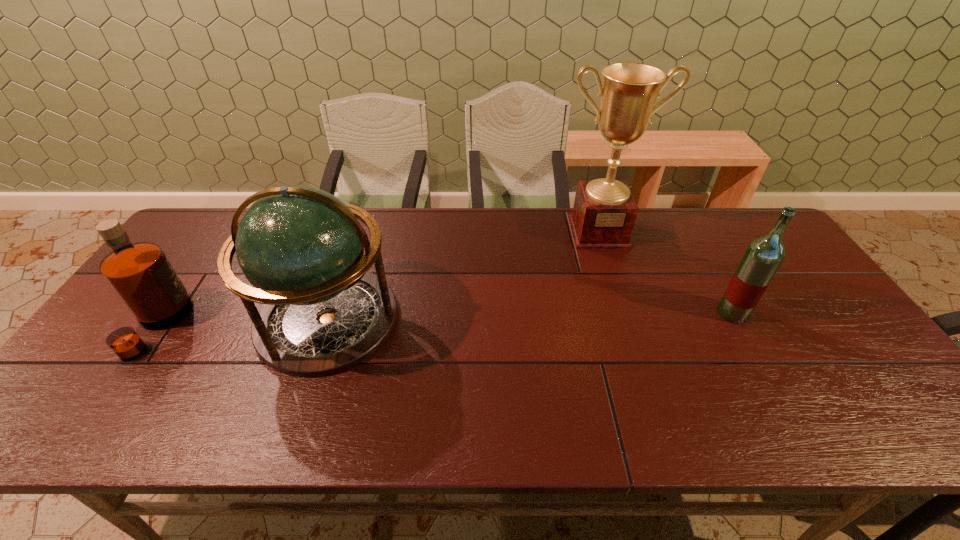
I want to click on the tallest object, so click(x=604, y=212).

This screenshot has width=960, height=540. What are the coordinates of `the farthest object` in the screenshot? It's located at (604, 212).

Identify the location of the second object from left to right. (302, 249).

The image size is (960, 540). Find the location of `globe`. globe is located at coordinates (302, 249).

Locate an element on the screen. the right liquor is located at coordinates (764, 255).

I want to click on the left liquor, so click(x=140, y=274).

The width and height of the screenshot is (960, 540). Find the location of `free region located 0.260m on the plaque of the farthest object`. free region located 0.260m on the plaque of the farthest object is located at coordinates (624, 310).

I want to click on free space located on the front-facing side of the globe, so click(298, 408).

This screenshot has height=540, width=960. Identify the location of free region located 0.150m on the back of the right liquor. (707, 266).

You are a GUI agent. You are given a task and a screenshot of the screen. Output one action in this format:
    pyautogui.click(x=<x>, y=<y>)
    Task: Click on the free point located on the front label of the left liquor
    
    Given the screenshot: What is the action you would take?
    pyautogui.click(x=294, y=326)